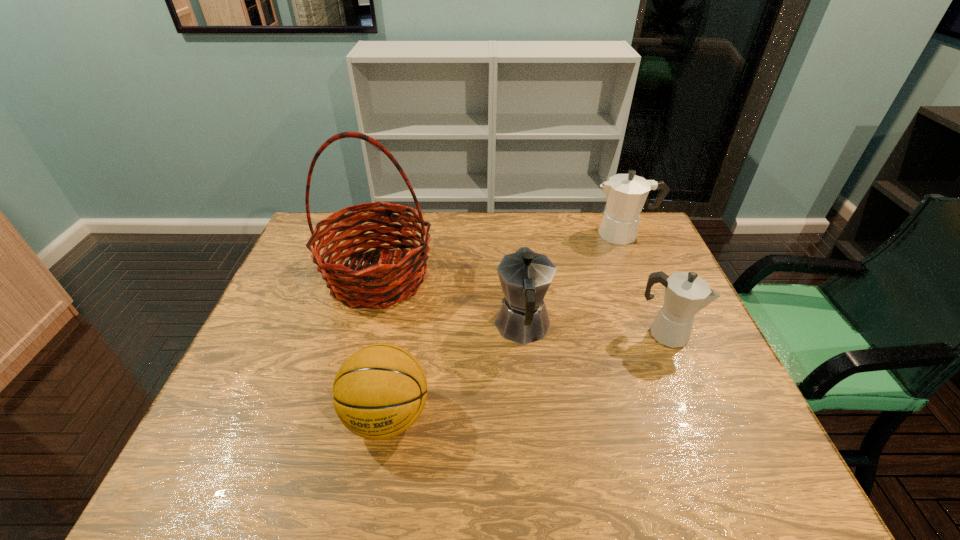
Identify the location of vacant space that satisfies the following two spatial constraints: 1. at the spout of the farthest coffeepot; 2. on the surface of the nearest object near the brand logo. (700, 416).

Where is `free space in the image that satisfies the following two spatial constraints: 1. at the spout of the farthest coffeepot; 2. on the surface of the basketball near the brand logo`? The width and height of the screenshot is (960, 540). free space in the image that satisfies the following two spatial constraints: 1. at the spout of the farthest coffeepot; 2. on the surface of the basketball near the brand logo is located at coordinates (700, 416).